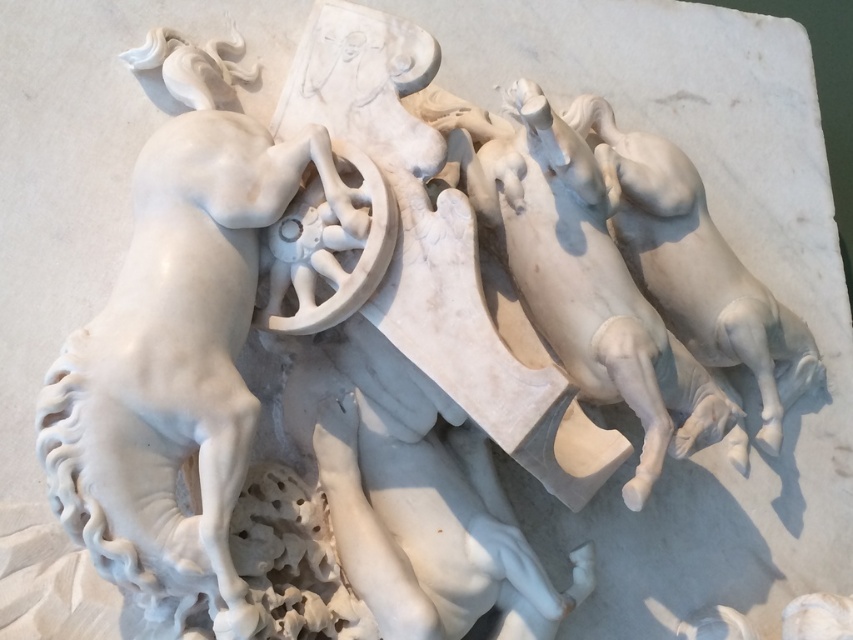
Question: Is white marble horses at center to the left of white marble horse at right from the viewer's perspective?

Choices:
 (A) no
 (B) yes

Answer: (B)

Question: Does white marble horses at center have a lesser width compared to white marble horse at right?

Choices:
 (A) yes
 (B) no

Answer: (B)

Question: Which object is farther from the camera taking this photo?

Choices:
 (A) white marble horse at left
 (B) white marble horses at center

Answer: (B)

Question: Among these objects, which one is farthest from the camera?

Choices:
 (A) white marble horses at center
 (B) white marble horse at right
 (C) white marble horse at left

Answer: (B)

Question: Does white marble horse at left appear on the right side of white marble horses at center?

Choices:
 (A) no
 (B) yes

Answer: (A)

Question: Which of the following is the farthest from the observer?

Choices:
 (A) white marble horses at center
 (B) white marble horse at left
 (C) white marble horse at right

Answer: (C)